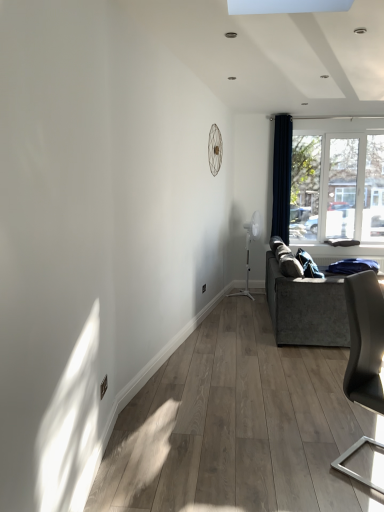
Question: Is navy blue velvet curtain at right a part of matte gray chair at right?

Choices:
 (A) no
 (B) yes

Answer: (A)

Question: Is matte gray chair at right closer to the viewer compared to navy blue velvet curtain at right?

Choices:
 (A) yes
 (B) no

Answer: (A)

Question: Considering the relative sizes of matte gray chair at right and navy blue velvet curtain at right in the image provided, is matte gray chair at right taller than navy blue velvet curtain at right?

Choices:
 (A) yes
 (B) no

Answer: (B)

Question: Does matte gray chair at right turn towards navy blue velvet curtain at right?

Choices:
 (A) yes
 (B) no

Answer: (B)

Question: From the image's perspective, does matte gray chair at right appear higher than navy blue velvet curtain at right?

Choices:
 (A) yes
 (B) no

Answer: (B)

Question: Considering the positions of point (329, 222) and point (311, 311), is point (329, 222) closer or farther from the camera than point (311, 311)?

Choices:
 (A) closer
 (B) farther

Answer: (B)

Question: From the image's perspective, relative to velvet grey couch at right, is white plastic window at right above or below?

Choices:
 (A) above
 (B) below

Answer: (A)

Question: In terms of width, does white plastic window at right look wider or thinner when compared to velvet grey couch at right?

Choices:
 (A) wide
 (B) thin

Answer: (B)

Question: Is white plastic window at right bigger or smaller than velvet grey couch at right?

Choices:
 (A) small
 (B) big

Answer: (A)

Question: Looking at their shapes, would you say matte gray chair at right is wider or thinner than velvet grey couch at right?

Choices:
 (A) thin
 (B) wide

Answer: (A)

Question: From a real-world perspective, is matte gray chair at right above or below velvet grey couch at right?

Choices:
 (A) above
 (B) below

Answer: (A)

Question: Visually, is matte gray chair at right positioned to the left or to the right of velvet grey couch at right?

Choices:
 (A) left
 (B) right

Answer: (A)

Question: Relative to velvet grey couch at right, is matte gray chair at right in front or behind?

Choices:
 (A) behind
 (B) front

Answer: (B)

Question: Considering the positions of velvet grey couch at right and white plastic window at right in the image, is velvet grey couch at right wider or thinner than white plastic window at right?

Choices:
 (A) wide
 (B) thin

Answer: (A)

Question: Is velvet grey couch at right bigger or smaller than white plastic window at right?

Choices:
 (A) small
 (B) big

Answer: (B)